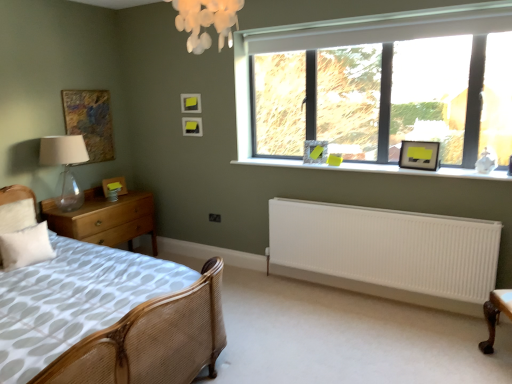
Identify the location of vacant space positioned to the left of white ribbed radiator at lower center. This screenshot has height=384, width=512. (284, 307).